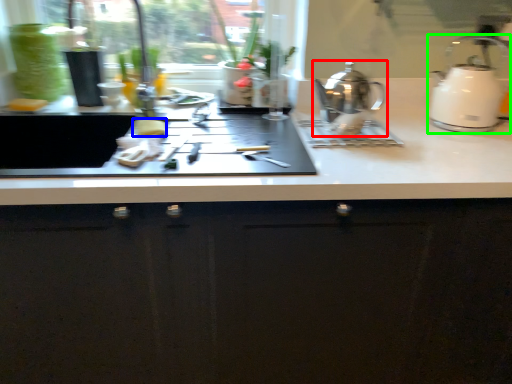
Question: Which object is the closest to the kettle (highlighted by a red box)? Choose among these: food (highlighted by a blue box) or kettle (highlighted by a green box).

Choices:
 (A) food
 (B) kettle

Answer: (B)